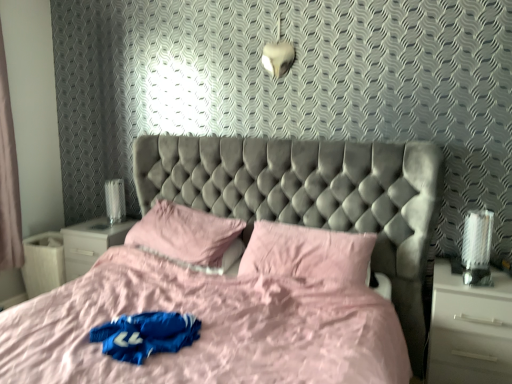
Question: Is white glossy nightstand at lower left, acting as the 2th nightstand starting from the front, in front of or behind white glossy nightstand at right, positioned as the second nightstand in left-to-right order, in the image?

Choices:
 (A) behind
 (B) front

Answer: (A)

Question: Based on their positions, is white glossy nightstand at lower left, positioned as the first nightstand in left-to-right order, located to the left or right of white glossy nightstand at right, positioned as the second nightstand in left-to-right order?

Choices:
 (A) left
 (B) right

Answer: (A)

Question: Considering the real-world distances, which object is closest to the white glossy table lamp at left?

Choices:
 (A) pink fabric pillow at center, marked as the second pillow in a right-to-left arrangement
 (B) pink fabric curtain at left
 (C) white glossy nightstand at lower left, positioned as the first nightstand in left-to-right order
 (D) pink satin pillow at center, placed as the second pillow when sorted from left to right
 (E) velvet grey bed at center

Answer: (C)

Question: Estimate the real-world distances between objects in this image. Which object is farther from the pink fabric curtain at left?

Choices:
 (A) pink fabric pillow at center, positioned as the 1th pillow in left-to-right order
 (B) white glossy table lamp at left
 (C) velvet grey bed at center
 (D) pink satin pillow at center, placed as the second pillow when sorted from left to right
 (E) white glossy nightstand at lower left, positioned as the first nightstand in left-to-right order

Answer: (D)